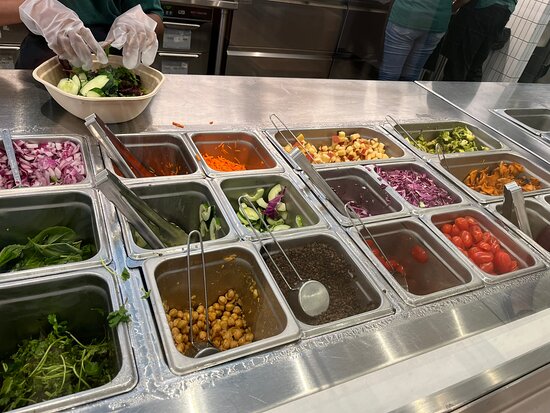
At what (x,y) coordinates should I click in order to perform the action: click on oven controls. Please return your answer as a coordinate pair (x, y). Looking at the image, I should click on (173, 32), (178, 66).